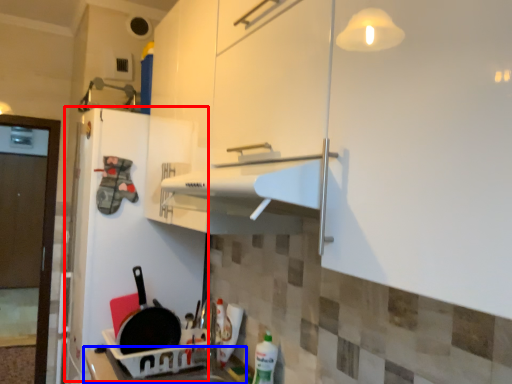
Question: Which point is closer to the camera, fridge (highlighted by a red box) or counter top (highlighted by a blue box)?

Choices:
 (A) fridge
 (B) counter top

Answer: (B)